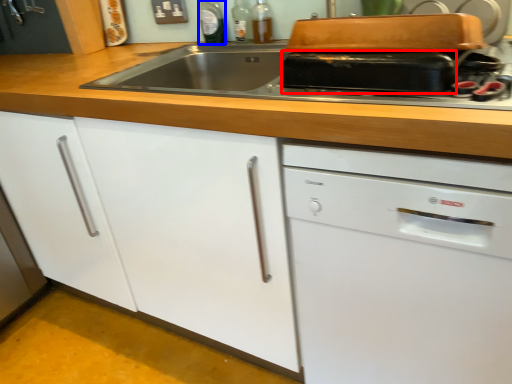
Question: Which of the following is the closest to the observer, kitchen appliance (highlighted by a red box) or bottle (highlighted by a blue box)?

Choices:
 (A) kitchen appliance
 (B) bottle

Answer: (A)